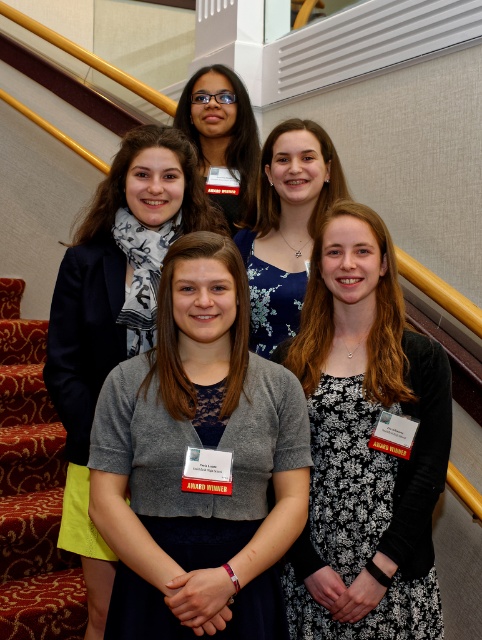
The height and width of the screenshot is (640, 482). What do you see at coordinates (185, 458) in the screenshot?
I see `gray matte cardigan at center` at bounding box center [185, 458].

Does gray matte cardigan at center appear over blue floral dress at center?

Actually, gray matte cardigan at center is below blue floral dress at center.

Find the location of `gray matte cardigan at center`. gray matte cardigan at center is located at coordinates (185, 458).

Who is lower down, gray matte cardigan at center or black floral dress at center?

Positioned lower is gray matte cardigan at center.

Does gray matte cardigan at center have a greater width compared to black floral dress at center?

Correct, the width of gray matte cardigan at center exceeds that of black floral dress at center.

Who is more forward, (206,307) or (318,403)?

Point (206,307)

Where is `gray matte cardigan at center`? gray matte cardigan at center is located at coordinates (185, 458).

Who is positioned more to the right, gray knit cardigan at center or blue floral dress at center?

Positioned to the right is blue floral dress at center.

Can you confirm if gray knit cardigan at center is thinner than blue floral dress at center?

No.

Image resolution: width=482 pixels, height=640 pixels. What are the coordinates of `gray knit cardigan at center` in the screenshot? It's located at (115, 310).

Find the location of a particular element. The image size is (482, 640). gray knit cardigan at center is located at coordinates (115, 310).